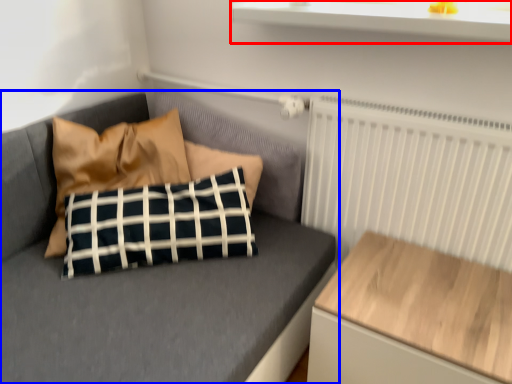
Question: Which of the following is the closest to the observer, window sill (highlighted by a red box) or studio couch (highlighted by a blue box)?

Choices:
 (A) window sill
 (B) studio couch

Answer: (A)